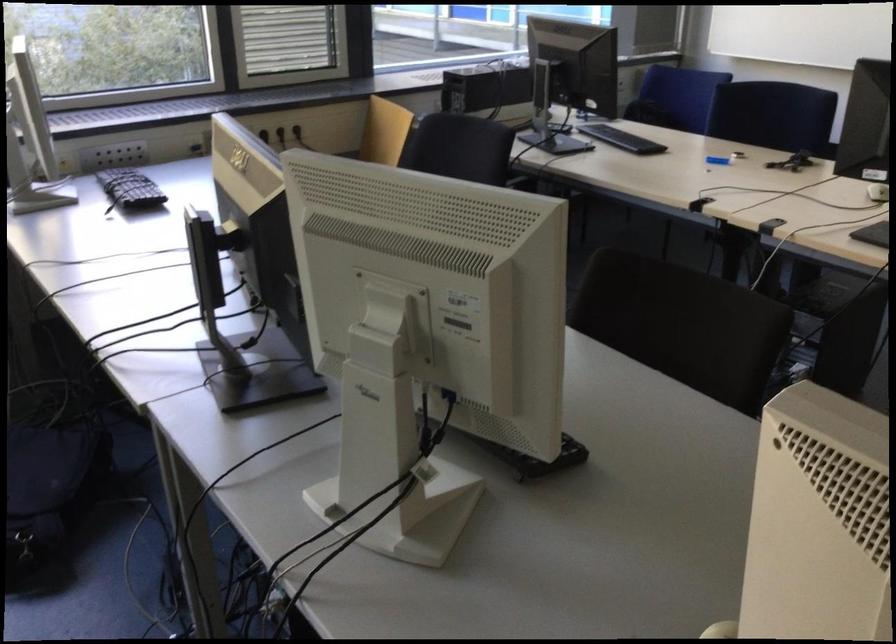
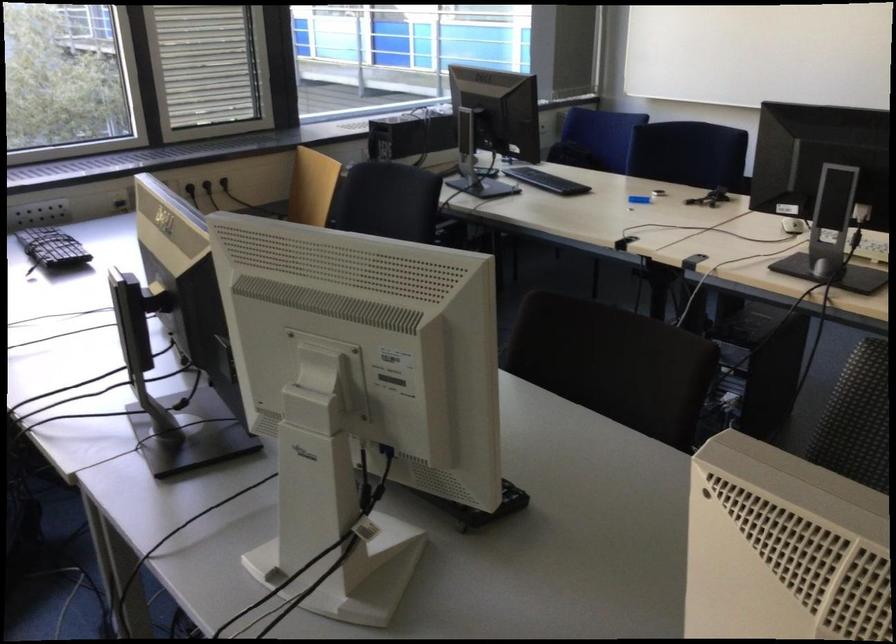
The point at (716, 161) is marked in the first image. Where is the corresponding point in the second image?

(640, 200)